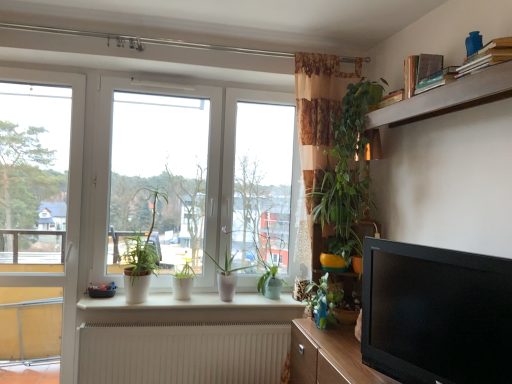
Find the location of a particular element. The image size is (512, 384). blank space situated above beige textured radiator at lower center (from a real-world perspective) is located at coordinates (190, 319).